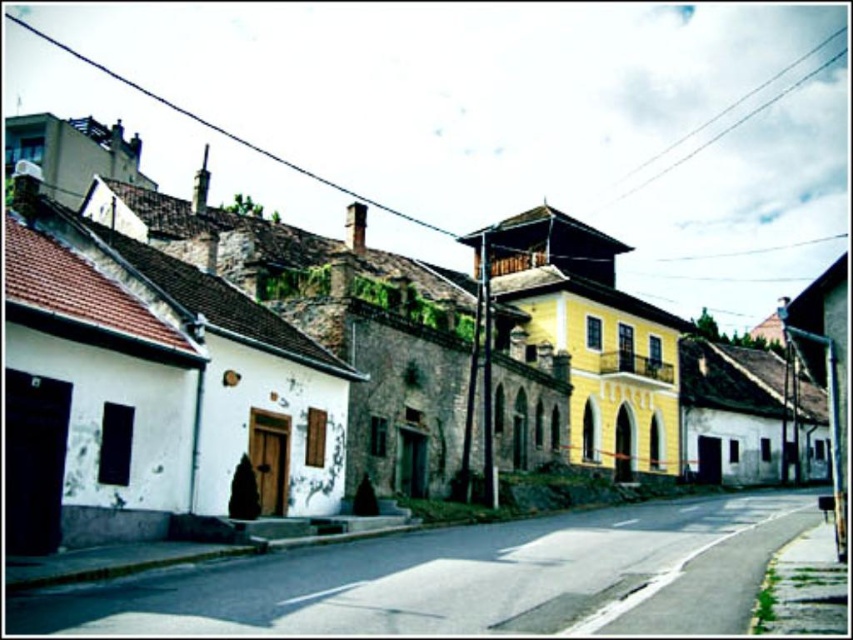
You are a tourist standing on the sidewalk next to the white stone building at left. You want to walk straight ahead towards the road. Will the metallic pole at right block your path?

The white stone building at left is in front of the metallic pole at right, so the metallic pole at right is behind the building and won

You are a delivery person with a cart that is 10 feet wide. You need to navigate through the space between the white stone building at left and the metallic pole at right. Can your cart fit through this space?

The distance between the white stone building at left and the metallic pole at right is 183.89 feet, which is significantly wider than the cart that is 10 feet wide. Therefore, the cart can easily fit through this space.

You are a tourist standing on the sidewalk next to the white stone building at left and want to take a photo of the metallic pole at right. Which object should you focus your camera on first to ensure both are in frame?

The white stone building at left is bigger than the metallic pole at right, so you should focus your camera on the metallic pole at right first to ensure both are in frame.